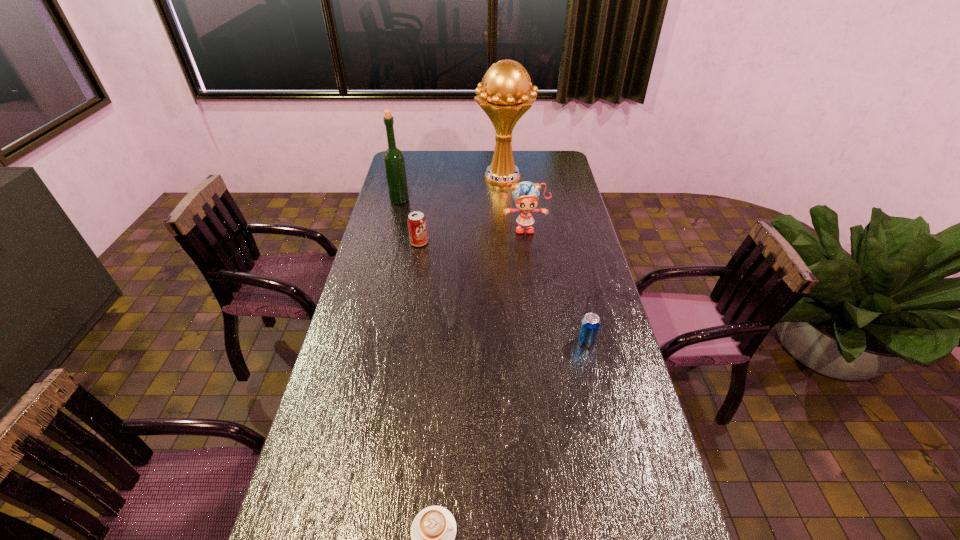
You are a GUI agent. You are given a task and a screenshot of the screen. Output one action in this format:
    pyautogui.click(x=<x>, y=<y>)
    Task: Click on the farthest object
    This screenshot has height=540, width=960.
    Given the screenshot: What is the action you would take?
    pyautogui.click(x=503, y=94)

The image size is (960, 540). What are the coordinates of `trophy_cup` in the screenshot? It's located at [x=503, y=94].

Identify the location of liquor. (394, 163).

Image resolution: width=960 pixels, height=540 pixels. I want to click on the second tallest object, so click(394, 163).

Identify the location of the third tallest object. Image resolution: width=960 pixels, height=540 pixels. (525, 194).

The width and height of the screenshot is (960, 540). Find the location of `the third farthest object`. the third farthest object is located at coordinates (525, 194).

This screenshot has width=960, height=540. I want to click on soda can, so click(x=417, y=227).

This screenshot has width=960, height=540. Find the location of `the fifth object from right to left`. the fifth object from right to left is located at coordinates (417, 227).

Where is `beer can`? The height and width of the screenshot is (540, 960). beer can is located at coordinates (590, 323).

Locate an element on the screen. The height and width of the screenshot is (540, 960). the second shortest object is located at coordinates (590, 323).